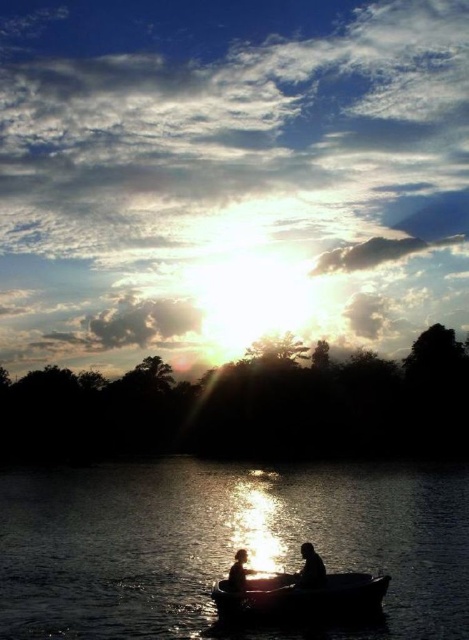
You are standing at the point where the sun is setting in the image. Which object in the scene is exactly at the point labeled as point (224,541)?

The silvery reflective water at center is located at point (224,541).

You are standing on the shore and see the silvery reflective water at center and the silhouette human at center in the sunset scene. Which object is positioned to the left of the other?

The silvery reflective water at center is to the left of the silhouette human at center.